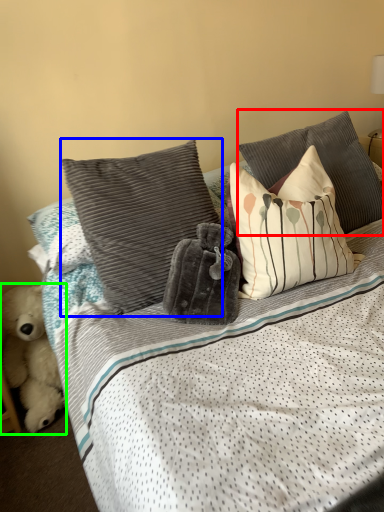
Question: Which object is positioned closest to pillow (highlighted by a red box)? Select from pillow (highlighted by a blue box) and teddy bear (highlighted by a green box).

Choices:
 (A) pillow
 (B) teddy bear

Answer: (A)